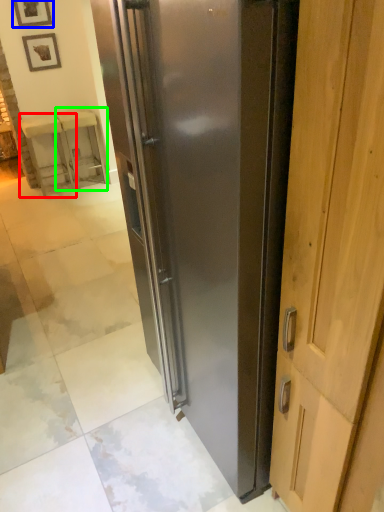
Question: Estimate the real-world distances between objects in this image. Which object is farther from furniture (highlighted by a red box), picture frame (highlighted by a blue box) or furniture (highlighted by a green box)?

Choices:
 (A) picture frame
 (B) furniture

Answer: (A)